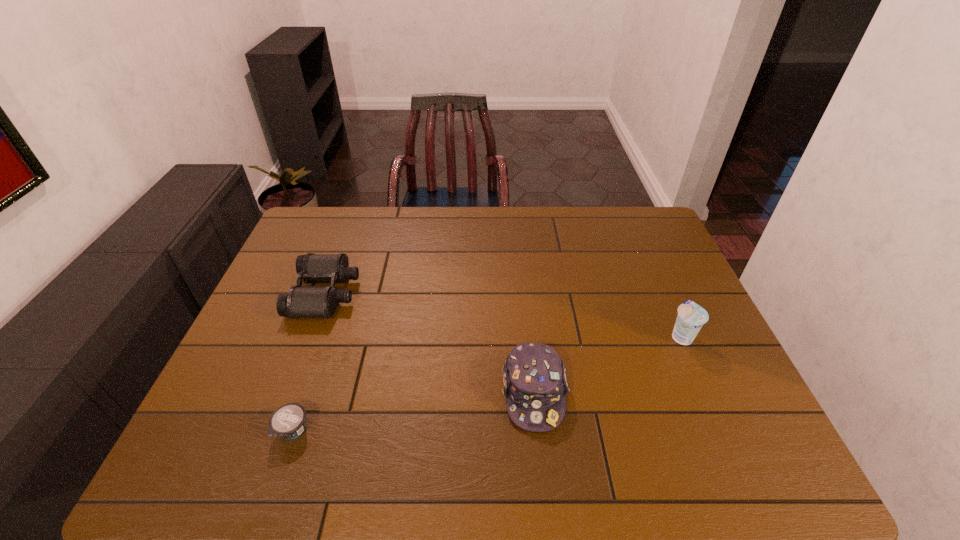
This screenshot has height=540, width=960. Identify the location of object at the near edge. (288, 421).

Identify the location of object that is at the left edge. This screenshot has height=540, width=960. (301, 301).

The width and height of the screenshot is (960, 540). I want to click on object that is at the right edge, so click(691, 317).

In order to click on vacant space at the far edge in this screenshot , I will do `click(467, 245)`.

Identify the location of vacant space at the near edge of the desktop. (352, 469).

You are a GUI agent. You are given a task and a screenshot of the screen. Output one action in this format:
    pyautogui.click(x=<x>, y=<y>)
    Task: Click on the blank space at the left edge
    The height and width of the screenshot is (540, 960).
    Given the screenshot: What is the action you would take?
    pyautogui.click(x=264, y=312)

Locate an element on the screen. This screenshot has width=960, height=540. free space at the right edge is located at coordinates (710, 355).

The image size is (960, 540). I want to click on blank space at the far left corner, so pos(327,211).

Locate an element on the screen. free space at the near left corner of the desktop is located at coordinates (213, 449).

Locate an element on the screen. This screenshot has width=960, height=540. free space at the far right corner of the desktop is located at coordinates (648, 226).